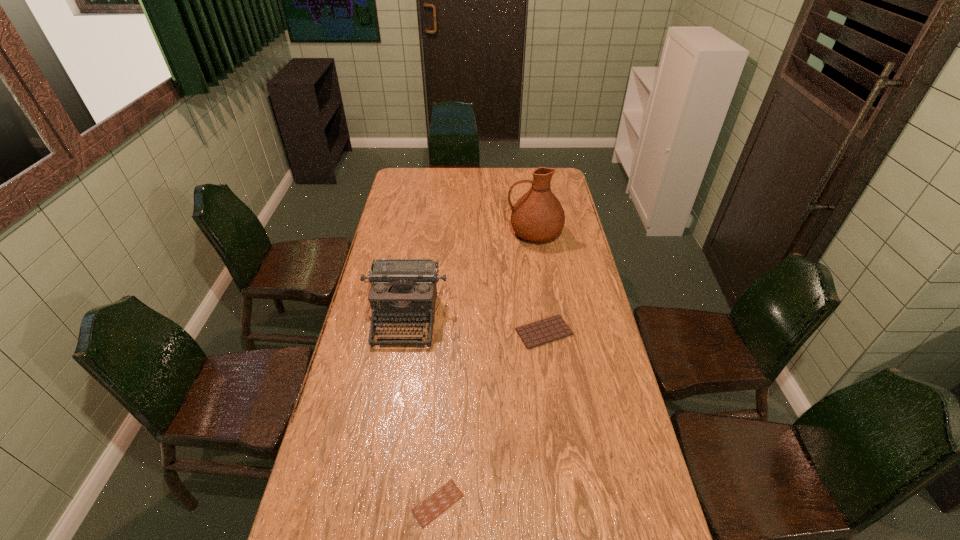
Select which object is the second closest to the pitcher. Please provide its 2D coordinates. Your answer should be formatted as a tuple, i.e. [(x, y)], where the tuple contains the x and y coordinates of a point satisfying the conditions above.

[(550, 329)]

You are a GUI agent. You are given a task and a screenshot of the screen. Output one action in this format:
    pyautogui.click(x=<x>, y=<y>)
    Task: Click on the vacant space that satisfies the following two spatial constraints: 1. on the side of the pitcher with the handle; 2. on the typing side of the second tallest object
    
    Given the screenshot: What is the action you would take?
    pos(547,317)

Find the location of a particular element. The image size is (960, 540). free location that satisfies the following two spatial constraints: 1. on the side of the tallest object with the handle; 2. on the typing side of the typewriter is located at coordinates (547, 317).

Find the location of `free space in the image that satisfies the following two spatial constraints: 1. on the side of the farthest object with the handle; 2. on the typing side of the typewriter`. free space in the image that satisfies the following two spatial constraints: 1. on the side of the farthest object with the handle; 2. on the typing side of the typewriter is located at coordinates (547, 317).

At what (x,y) coordinates should I click in order to perform the action: click on free spot that satisfies the following two spatial constraints: 1. on the typing side of the typewriter; 2. on the left side of the shortest object. Please return your answer as a coordinate pair (x, y). The width and height of the screenshot is (960, 540). Looking at the image, I should click on click(x=374, y=503).

Find the location of a particular element. This screenshot has width=960, height=540. free space that satisfies the following two spatial constraints: 1. on the typing side of the nearest object; 2. on the right side of the second tallest object is located at coordinates (374, 503).

I want to click on free space that satisfies the following two spatial constraints: 1. on the side of the pitcher with the handle; 2. on the front side of the farther chocolate bar, so click(550, 332).

You are a GUI agent. You are given a task and a screenshot of the screen. Output one action in this format:
    pyautogui.click(x=<x>, y=<y>)
    Task: Click on the free space that satisfies the following two spatial constraints: 1. on the back side of the nearest object; 2. on the right side of the taller chocolate bar
    This screenshot has height=540, width=960.
    Given the screenshot: What is the action you would take?
    pyautogui.click(x=449, y=332)

At what (x,y) coordinates should I click in order to perform the action: click on blank space that satisfies the following two spatial constraints: 1. on the side of the farthest object with the handle; 2. on the typing side of the second tallest object. Please return your answer as a coordinate pair (x, y). Image resolution: width=960 pixels, height=540 pixels. Looking at the image, I should click on (547, 317).